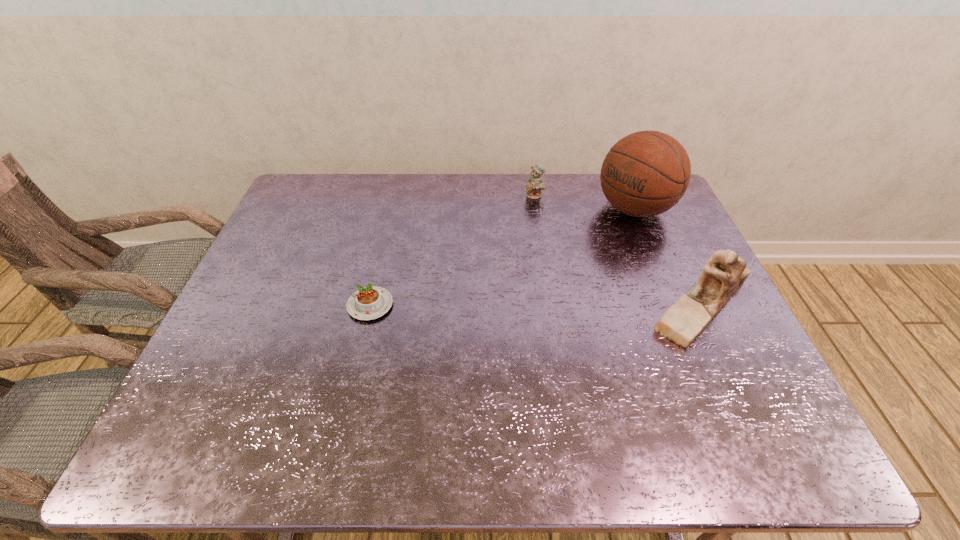
Identify the location of vacant point that satisfies the following two spatial constraints: 1. on the front side of the figurine; 2. on the front-facing side of the teddy bear. This screenshot has height=540, width=960. (551, 305).

Locate an element on the screen. This screenshot has width=960, height=540. vacant space that satisfies the following two spatial constraints: 1. on the front side of the third shortest object; 2. on the front-facing side of the leftmost object is located at coordinates (371, 305).